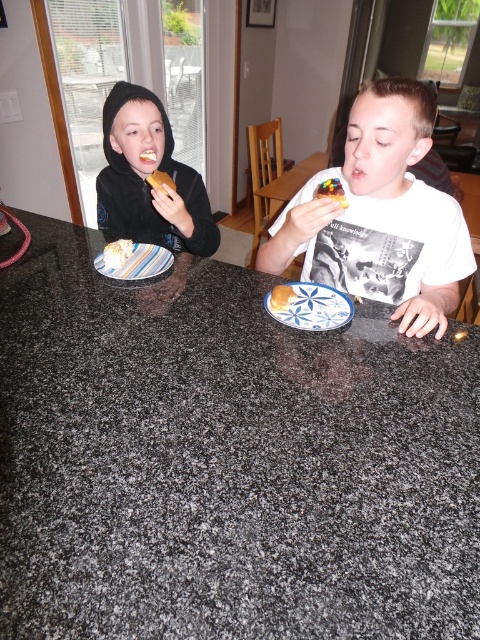
Question: Based on their relative distances, which object is farther from the granite black table at center?

Choices:
 (A) matte brown pastry at center
 (B) blue and white ceramic plate at center

Answer: (A)

Question: Observing the image, what is the correct spatial positioning of blue and white ceramic plate at center in reference to white cake at left?

Choices:
 (A) left
 (B) right

Answer: (B)

Question: Can you confirm if white matte t-shirt at center is bigger than striped paper plate at center?

Choices:
 (A) no
 (B) yes

Answer: (B)

Question: Which object appears closest to the camera in this image?

Choices:
 (A) matte yellow cake at center
 (B) granite black table at center
 (C) blue and white ceramic plate at center

Answer: (B)

Question: Which object is farther from the camera taking this photo?

Choices:
 (A) white cake at left
 (B) granite black table at center

Answer: (A)

Question: Is white matte t-shirt at center thinner than matte brown pastry at center?

Choices:
 (A) yes
 (B) no

Answer: (B)